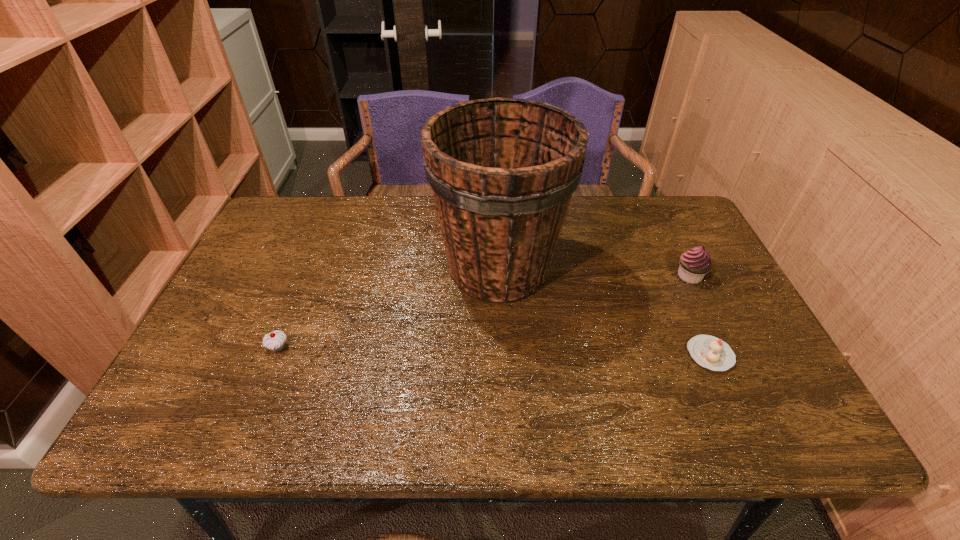
The image size is (960, 540). What are the coordinates of `vacant space that's between the third shortest object and the second shortest object` in the screenshot? It's located at (484, 312).

The height and width of the screenshot is (540, 960). Identify the location of free space between the third shortest object and the bucket. click(594, 272).

You are a GUI agent. You are given a task and a screenshot of the screen. Output one action in this format:
    pyautogui.click(x=<x>, y=<y>)
    Task: Click on the free point between the second tallest object and the shortest cupcake
    The height and width of the screenshot is (540, 960).
    Given the screenshot: What is the action you would take?
    pyautogui.click(x=700, y=315)

Identify the location of empty space between the shortest object and the third object from right to left. Image resolution: width=960 pixels, height=540 pixels. (605, 311).

At what (x,y) coordinates should I click in order to perform the action: click on free spot between the shortest object and the leftmost cupcake. Please return your answer as a coordinate pair (x, y). This screenshot has height=540, width=960. Looking at the image, I should click on (494, 351).

The height and width of the screenshot is (540, 960). Identify the location of vacant area that lies between the third tallest object and the second object from left to right. (389, 308).

The height and width of the screenshot is (540, 960). Find the location of `free area in between the second shortest cupcake and the tallest cupcake`. free area in between the second shortest cupcake and the tallest cupcake is located at coordinates (484, 312).

Select which object appears as the third closest to the tallest object. Please provide its 2D coordinates. Your answer should be formatted as a tuple, i.e. [(x, y)], where the tuple contains the x and y coordinates of a point satisfying the conditions above.

[(275, 341)]

Select which object appears as the second closest to the leftmost object. Please provide its 2D coordinates. Your answer should be formatted as a tuple, i.e. [(x, y)], where the tuple contains the x and y coordinates of a point satisfying the conditions above.

[(708, 351)]

Locate which cupcake is the closest to the third shortest object. Please provide its 2D coordinates. Your answer should be formatted as a tuple, i.e. [(x, y)], where the tuple contains the x and y coordinates of a point satisfying the conditions above.

[(708, 351)]